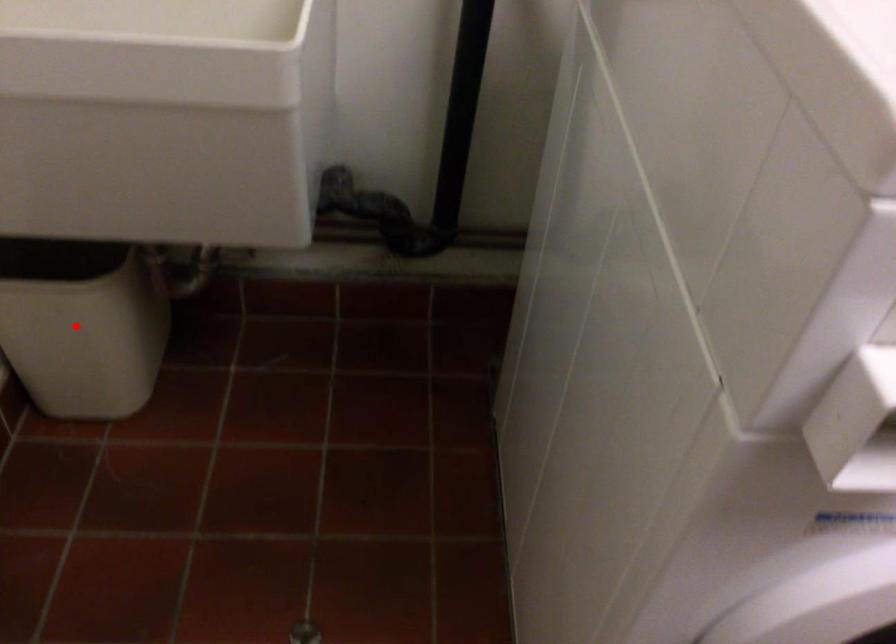
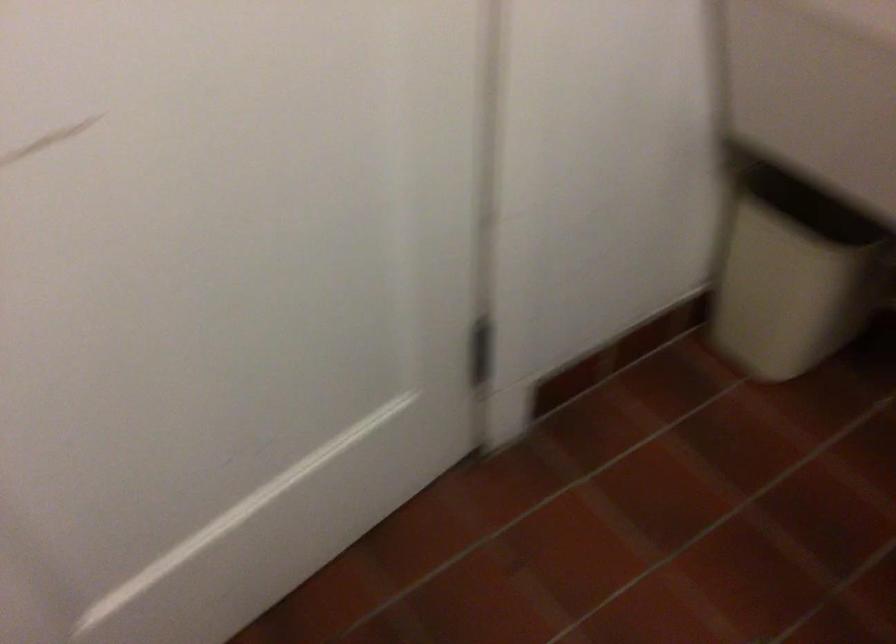
The point at the highlighted location is marked in the first image. Where is the corresponding point in the second image?

(794, 272)